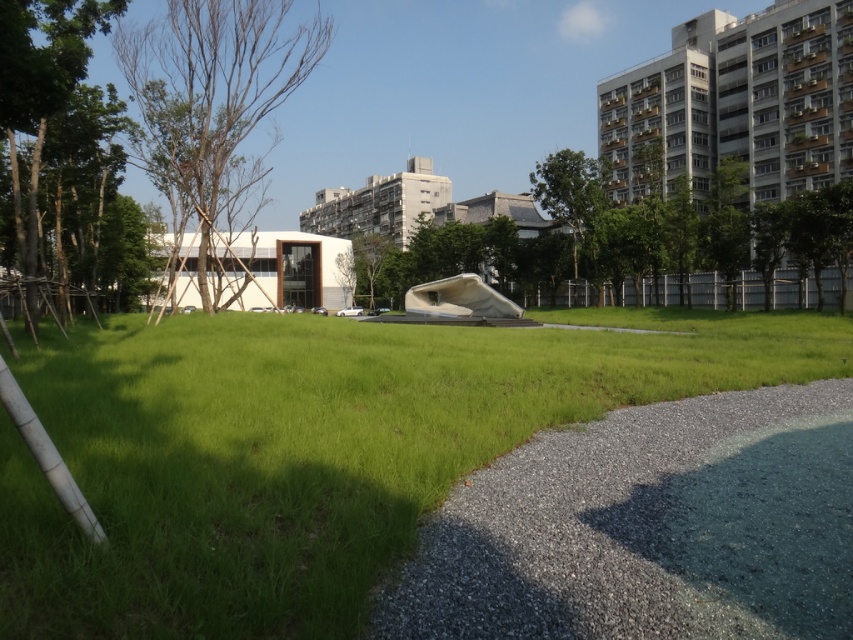
How distant is green grass at center from brown wood tree at left?

They are 7.12 meters apart.

Can you confirm if green grass at center is taller than brown wood tree at left?

No, green grass at center is not taller than brown wood tree at left.

What do you see at coordinates (312, 451) in the screenshot? I see `green grass at center` at bounding box center [312, 451].

The width and height of the screenshot is (853, 640). I want to click on green grass at center, so click(x=312, y=451).

Can you confirm if green grass at center is shorter than gray gravel path at lower right?

No, green grass at center is not shorter than gray gravel path at lower right.

Between green grass at center and gray gravel path at lower right, which one appears on the left side from the viewer's perspective?

Positioned to the left is gray gravel path at lower right.

This screenshot has width=853, height=640. Describe the element at coordinates (312, 451) in the screenshot. I see `green grass at center` at that location.

Identify the location of green grass at center. This screenshot has width=853, height=640. (312, 451).

Does brown wood tree at left have a larger size compared to green leafy tree at upper right?

Indeed, brown wood tree at left has a larger size compared to green leafy tree at upper right.

Which is more to the left, brown wood tree at left or green leafy tree at upper right?

Positioned to the left is brown wood tree at left.

This screenshot has width=853, height=640. In order to click on brown wood tree at left in this screenshot , I will do `click(212, 113)`.

Locate an element on the screen. brown wood tree at left is located at coordinates (212, 113).